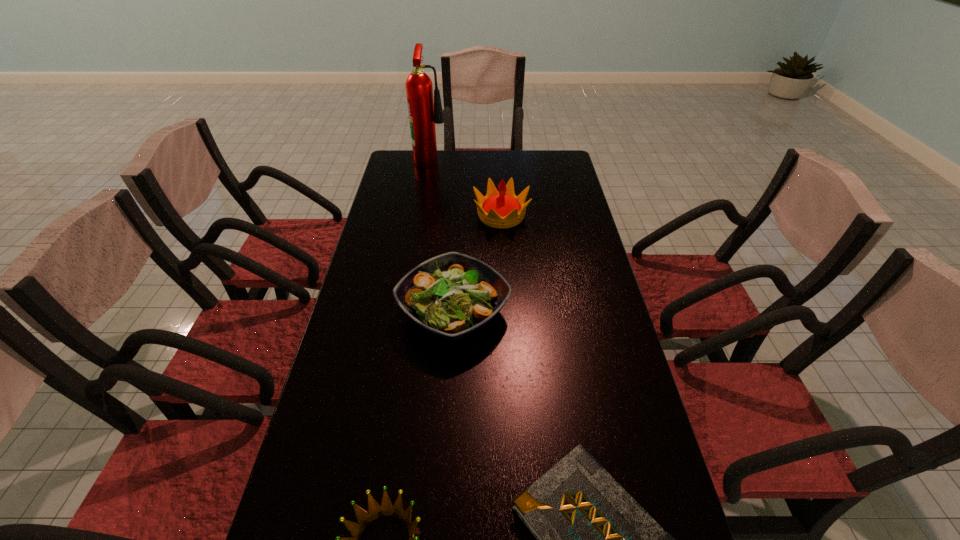
The width and height of the screenshot is (960, 540). Find the location of `fire extinguisher that is positioned at the left edge`. fire extinguisher that is positioned at the left edge is located at coordinates (424, 112).

You are a GUI agent. You are given a task and a screenshot of the screen. Output one action in this format:
    pyautogui.click(x=<x>, y=<y>)
    Task: Click on the salad plate that is at the left edge
    The image size is (960, 540).
    Given the screenshot: What is the action you would take?
    pyautogui.click(x=453, y=295)

Where is `object that is at the far left corner`? object that is at the far left corner is located at coordinates (424, 112).

In the image, there is a desktop. Identify the location of free space at the far edge. (526, 152).

Find the location of a particular element. The width and height of the screenshot is (960, 540). free space at the left edge of the desktop is located at coordinates (374, 273).

You are a GUI agent. You are given a task and a screenshot of the screen. Output one action in this format:
    pyautogui.click(x=<x>, y=<y>)
    Task: Click on the free space at the right edge of the desktop
    
    Given the screenshot: What is the action you would take?
    pyautogui.click(x=605, y=292)

This screenshot has width=960, height=540. What are the coordinates of `vacant space at the far left corner of the desktop` in the screenshot? It's located at (394, 168).

Locate an element on the screen. This screenshot has height=540, width=960. free space between the salad plate and the tallest object is located at coordinates (443, 235).

You are a GUI agent. You are given a task and a screenshot of the screen. Output one action in this format:
    pyautogui.click(x=<x>, y=<y>)
    Task: Click on the object that ranks as the closest to the left crown
    
    Given the screenshot: What is the action you would take?
    pyautogui.click(x=593, y=539)

Identify which object is the closest to the left crown. Please provide its 2D coordinates. Your answer should be formatted as a tuple, i.e. [(x, y)], where the tuple contains the x and y coordinates of a point satisfying the conditions above.

[(593, 539)]